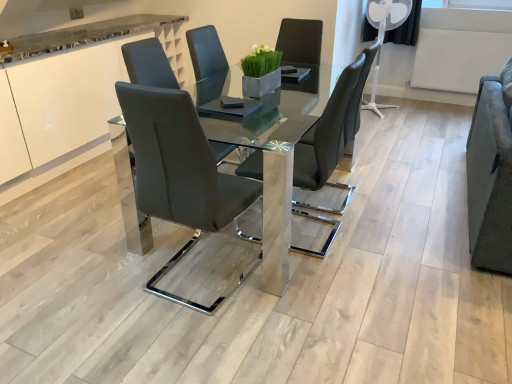
Locate an element on the screen. This screenshot has height=384, width=512. vacant space in front of matte black chair at center, the 2th chair viewed from the right is located at coordinates (191, 339).